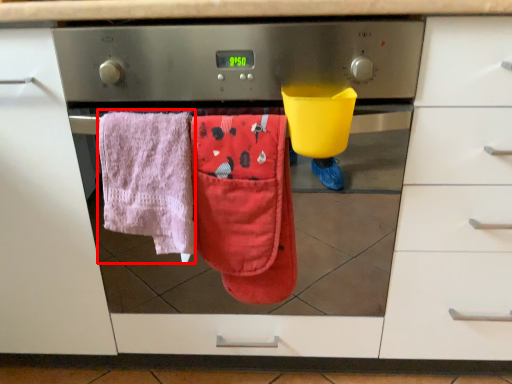
Question: From the image's perspective, what is the correct spatial relationship of beach towel (annotated by the red box) in relation to beach towel?

Choices:
 (A) above
 (B) below

Answer: (A)